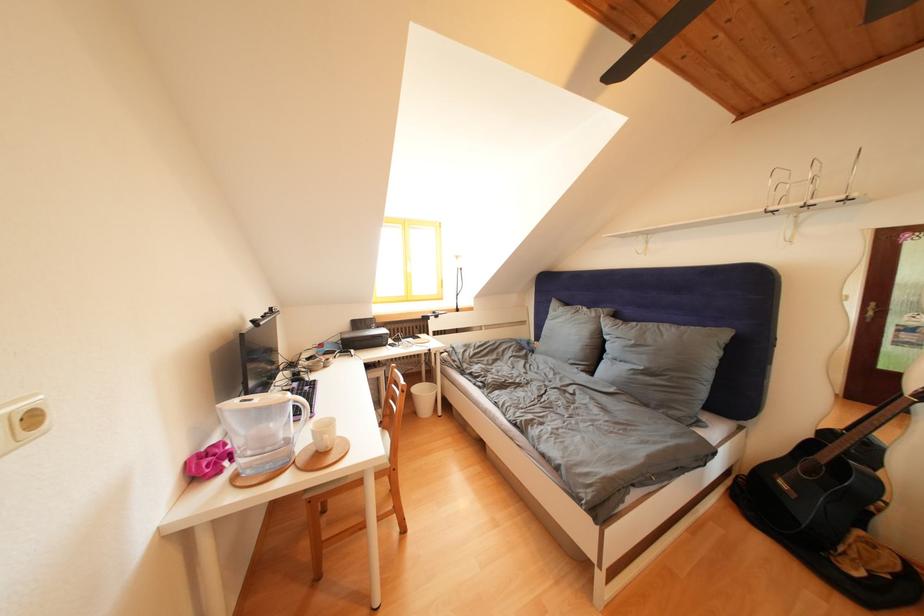
This screenshot has width=924, height=616. Describe the element at coordinates (298, 415) in the screenshot. I see `a water pitcher handle` at that location.